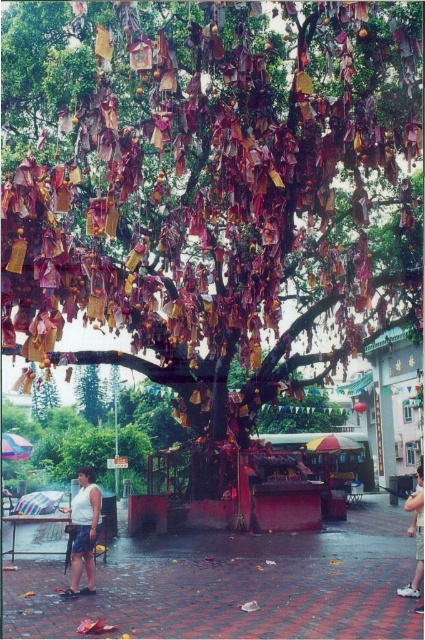
In the scene shown: Between white matte tank top at lower center and skinny jeans at lower right, which one has less height?

Standing shorter between the two is white matte tank top at lower center.

Which of these two, white matte tank top at lower center or skinny jeans at lower right, stands taller?

skinny jeans at lower right is taller.

This screenshot has width=425, height=640. What do you see at coordinates (84, 531) in the screenshot?
I see `white matte tank top at lower center` at bounding box center [84, 531].

This screenshot has height=640, width=425. What are the coordinates of `white matte tank top at lower center` in the screenshot? It's located at (84, 531).